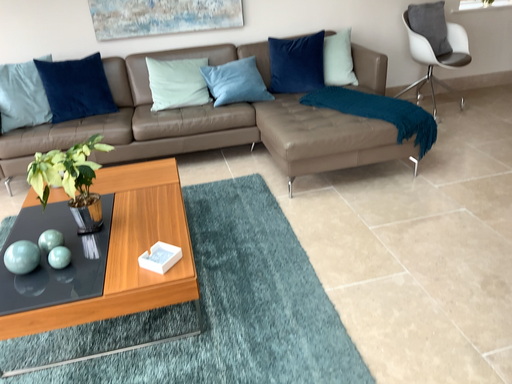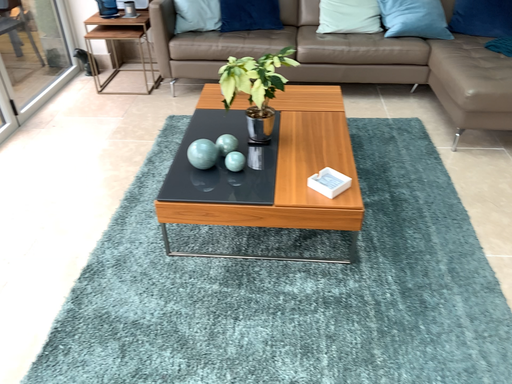
Question: How did the camera likely rotate when shooting the video?

Choices:
 (A) rotated upward
 (B) rotated downward

Answer: (B)